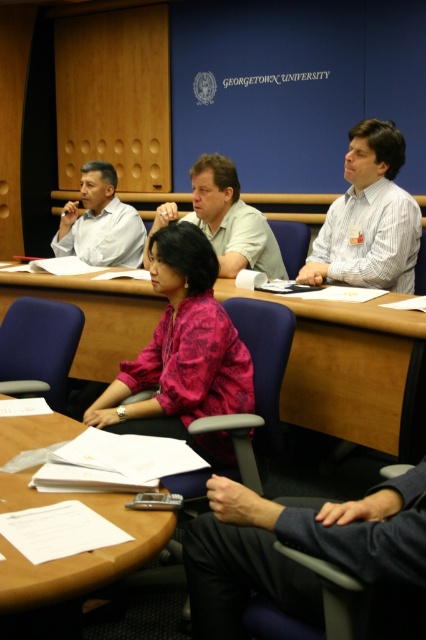
Question: Which point is closer to the camera?

Choices:
 (A) light brown shirt at center
 (B) matte white shirt at left
 (C) wooden table at center
 (D) pink floral blouse at center

Answer: (D)

Question: Can you confirm if wooden table at center is positioned to the right of white paper at center?

Choices:
 (A) yes
 (B) no

Answer: (A)

Question: Can you confirm if light brown shirt at center is positioned to the left of matte white shirt at left?

Choices:
 (A) no
 (B) yes

Answer: (A)

Question: Does wooden table at center have a larger size compared to dark blue fabric pants at lower right?

Choices:
 (A) yes
 (B) no

Answer: (A)

Question: Which of the following is the farthest from the observer?

Choices:
 (A) white paper at center
 (B) matte white shirt at left
 (C) wooden table at center
 (D) pink floral blouse at center

Answer: (B)

Question: Based on their relative distances, which object is farther from the dark blue fabric pants at lower right?

Choices:
 (A) wooden table at center
 (B) pink floral blouse at center

Answer: (A)